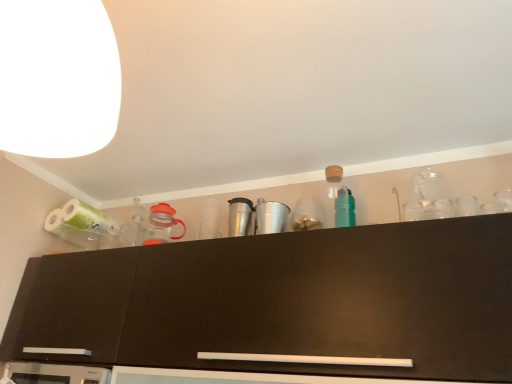
Describe the element at coordinates (57, 78) in the screenshot. I see `white matte lampshade at upper left` at that location.

Locate an element on the screen. white matte lampshade at upper left is located at coordinates (57, 78).

The image size is (512, 384). What do you see at coordinates (283, 302) in the screenshot? I see `matte black cabinet at upper center` at bounding box center [283, 302].

Find the location of a particular element. matte black cabinet at upper center is located at coordinates (283, 302).

From the picture: In order to face matte black cabinet at upper center, should I rotate leftwards or rightwards?

To align with it, rotate left about 4.379°.

Locate an element on the screen. Image resolution: width=512 pixels, height=384 pixels. white matte lampshade at upper left is located at coordinates (57, 78).

Which object is positioned more to the right, matte black cabinet at upper center or white matte lampshade at upper left?

matte black cabinet at upper center.

Is matte black cabinet at upper center in front of or behind white matte lampshade at upper left in the image?

Visually, matte black cabinet at upper center is located behind white matte lampshade at upper left.

Does point (388, 244) come in front of point (105, 22)?

No, it is not.

From the image's perspective, which one is positioned lower, matte black cabinet at upper center or white matte lampshade at upper left?

matte black cabinet at upper center appears lower in the image.

Consider the image. From a real-world perspective, does matte black cabinet at upper center stand above white matte lampshade at upper left?

No, from a real-world perspective, matte black cabinet at upper center is not over white matte lampshade at upper left

Between matte black cabinet at upper center and white matte lampshade at upper left, which one has smaller width?

With smaller width is white matte lampshade at upper left.

Who is shorter, matte black cabinet at upper center or white matte lampshade at upper left?

Standing shorter between the two is white matte lampshade at upper left.

Does matte black cabinet at upper center have a larger size compared to white matte lampshade at upper left?

Indeed, matte black cabinet at upper center has a larger size compared to white matte lampshade at upper left.

Based on the photo, would you say white matte lampshade at upper left is part of matte black cabinet at upper center's contents?

No, white matte lampshade at upper left is not a part of matte black cabinet at upper center.

Is matte black cabinet at upper center far from white matte lampshade at upper left?

Actually, matte black cabinet at upper center and white matte lampshade at upper left are a little close together.

Is matte black cabinet at upper center facing away from white matte lampshade at upper left?

No, matte black cabinet at upper center's orientation is not away from white matte lampshade at upper left.

How many degrees apart are the facing directions of matte black cabinet at upper center and white matte lampshade at upper left?

The angular difference between matte black cabinet at upper center and white matte lampshade at upper left is 2.21 degrees.

Locate an element on the screen. The height and width of the screenshot is (384, 512). cabinetry below the white matte lampshade at upper left (from a real-world perspective) is located at coordinates (283, 302).

In the scene shown: In the image, is white matte lampshade at upper left on the left side or the right side of matte black cabinet at upper center?

Based on their positions, white matte lampshade at upper left is located to the left of matte black cabinet at upper center.

Which object is more forward, white matte lampshade at upper left or matte black cabinet at upper center?

white matte lampshade at upper left.

Is point (6, 26) closer or farther from the camera than point (360, 324)?

Point (6, 26) is positioned closer to the camera compared to point (360, 324).

From the image's perspective, is white matte lampshade at upper left located above or below matte black cabinet at upper center?

white matte lampshade at upper left is above matte black cabinet at upper center.

From a real-world perspective, relative to matte black cabinet at upper center, is white matte lampshade at upper left vertically above or below?

Clearly, from a real-world perspective, white matte lampshade at upper left is above matte black cabinet at upper center.

Considering the relative sizes of white matte lampshade at upper left and matte black cabinet at upper center in the image provided, is white matte lampshade at upper left wider than matte black cabinet at upper center?

In fact, white matte lampshade at upper left might be narrower than matte black cabinet at upper center.

Considering the sizes of objects white matte lampshade at upper left and matte black cabinet at upper center in the image provided, who is taller, white matte lampshade at upper left or matte black cabinet at upper center?

matte black cabinet at upper center is taller.

Which of these two, white matte lampshade at upper left or matte black cabinet at upper center, is smaller?

Smaller between the two is white matte lampshade at upper left.

Is matte black cabinet at upper center completely or partially inside white matte lampshade at upper left?

No, matte black cabinet at upper center is not inside white matte lampshade at upper left.

Is white matte lampshade at upper left placed right next to matte black cabinet at upper center?

white matte lampshade at upper left is not next to matte black cabinet at upper center, and they're not touching.

Is white matte lampshade at upper left oriented towards matte black cabinet at upper center?

No, white matte lampshade at upper left does not turn towards matte black cabinet at upper center.

The image size is (512, 384). In the image, there is a white matte lampshade at upper left. Identify the location of cabinetry below it (from the image's perspective). (283, 302).

You are a GUI agent. You are given a task and a screenshot of the screen. Output one action in this format:
    pyautogui.click(x=<x>, y=<y>)
    Task: Click on the cabinetry to the right of white matte lampshade at upper left
    
    Given the screenshot: What is the action you would take?
    pyautogui.click(x=283, y=302)

In order to click on cabinetry directly beneath the white matte lampshade at upper left (from a real-world perspective) in this screenshot , I will do `click(283, 302)`.